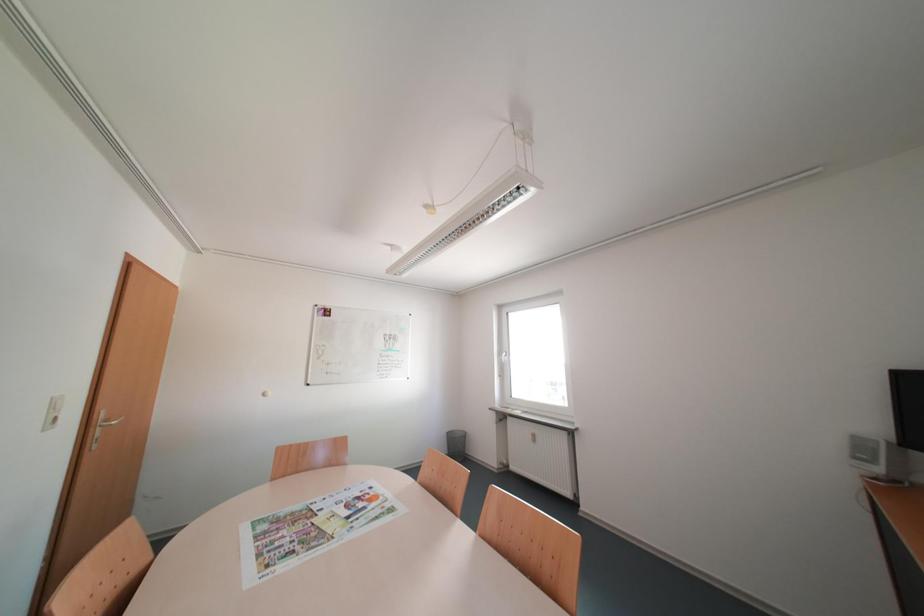
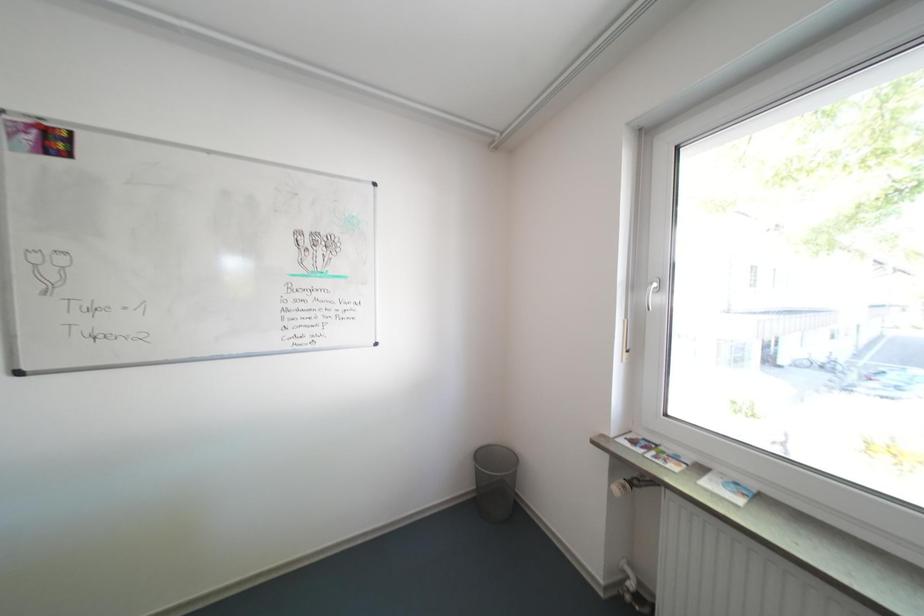
Question: What movement of the cameraman would produce the second image?

Choices:
 (A) Left
 (B) Right
 (C) Forward
 (D) Backward

Answer: (C)